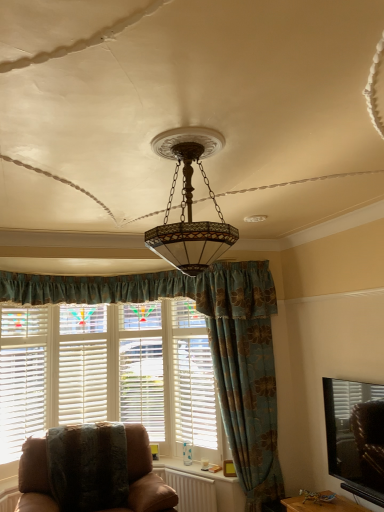
Question: From their relative heights in the image, would you say white wood window frame at center is taller or shorter than white plastic radiator at lower center?

Choices:
 (A) short
 (B) tall

Answer: (B)

Question: Is white wood window frame at center in front of or behind white plastic radiator at lower center in the image?

Choices:
 (A) behind
 (B) front

Answer: (A)

Question: Which of these objects is positioned closest to the matte glass chandelier at center?

Choices:
 (A) blue floral fabric curtain at center
 (B) matte white blinds at lower right
 (C) white plastic radiator at lower center
 (D) white wood shutter at center
 (E) white wood window frame at center

Answer: (A)

Question: Considering the real-world distances, which object is closest to the white wood shutter at center?

Choices:
 (A) white wooden blinds at left
 (B) matte glass chandelier at center
 (C) white wood window frame at center
 (D) brown leather chair at lower left
 (E) white plastic radiator at lower center

Answer: (C)